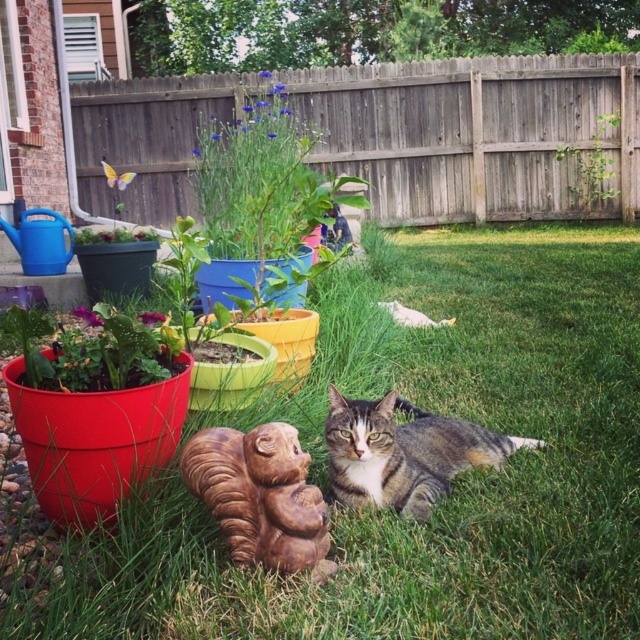
What do you see at coordinates (452, 481) in the screenshot? I see `green grass at center` at bounding box center [452, 481].

Does green grass at center have a larger size compared to green leafy plant at upper center?

Incorrect, green grass at center is not larger than green leafy plant at upper center.

This screenshot has height=640, width=640. In order to click on green grass at center in this screenshot , I will do `click(452, 481)`.

Is tabby fur cat at center bigger than white fur cat at center?

Indeed, tabby fur cat at center has a larger size compared to white fur cat at center.

Which of these two, tabby fur cat at center or white fur cat at center, stands taller?

Standing taller between the two is tabby fur cat at center.

Locate an element on the screen. The width and height of the screenshot is (640, 640). tabby fur cat at center is located at coordinates (404, 452).

The height and width of the screenshot is (640, 640). What are the coordinates of `tabby fur cat at center` in the screenshot? It's located at (404, 452).

Is green grass at center below wooden fence at upper center?

Yes.

Who is higher up, green grass at center or wooden fence at upper center?

Positioned higher is wooden fence at upper center.

Is point (572, 548) in front of point (547, 96)?

Yes, point (572, 548) is in front of point (547, 96).

You are a GUI agent. You are given a task and a screenshot of the screen. Output one action in this format:
    pyautogui.click(x=<x>, y=<y>)
    Task: Click on the green grass at center
    The width and height of the screenshot is (640, 640).
    Given the screenshot: What is the action you would take?
    pyautogui.click(x=452, y=481)